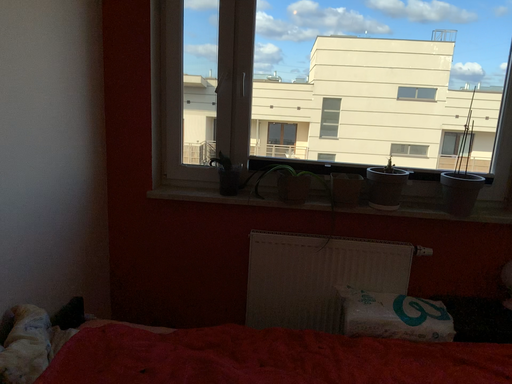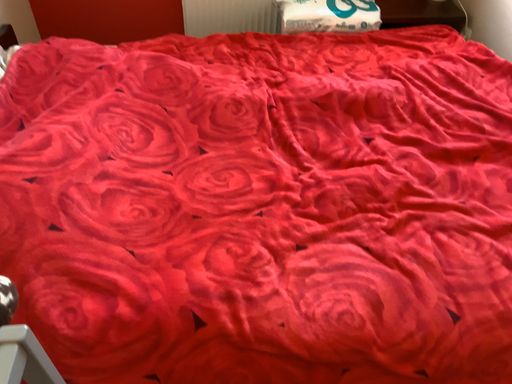
Question: Which way did the camera rotate in the video?

Choices:
 (A) rotated left
 (B) rotated right

Answer: (B)